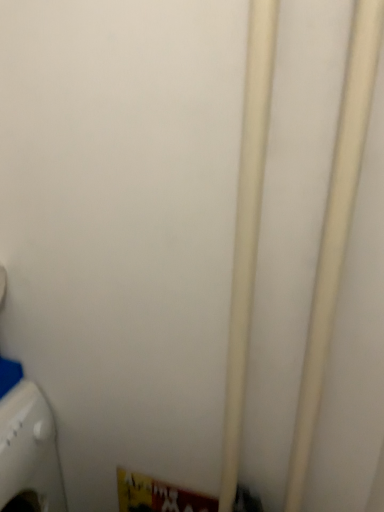
Question: Is white matte pipe at center, the 2th pipe viewed from the right, inside or outside of white plastic washing machine at lower left?

Choices:
 (A) outside
 (B) inside

Answer: (A)

Question: Is white matte pipe at center, the first pipe positioned from the left, in front of or behind white plastic washing machine at lower left in the image?

Choices:
 (A) behind
 (B) front

Answer: (B)

Question: Which object is positioned farthest from the white plastic washing machine at lower left?

Choices:
 (A) white matte pipe at center, the first pipe positioned from the left
 (B) white matte pipe at center, arranged as the 1th pipe when viewed from the right

Answer: (B)

Question: Estimate the real-world distances between objects in this image. Which object is closer to the white matte pipe at center, the first pipe positioned from the left?

Choices:
 (A) white plastic washing machine at lower left
 (B) white matte pipe at center, arranged as the 1th pipe when viewed from the right

Answer: (B)